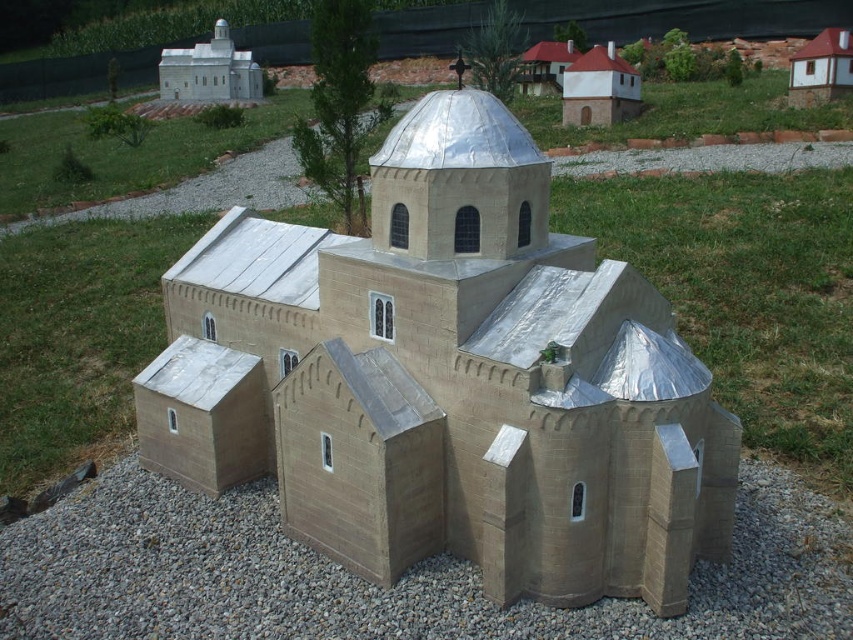
Can you confirm if white matte chapel at upper left is positioned above white wood house at upper right?

Yes.

Locate an element on the screen. white matte chapel at upper left is located at coordinates (209, 72).

Between point (213, 76) and point (827, 42), which one is positioned behind?

The point (213, 76) is more distant.

Find the location of `white matte chapel at upper left`. white matte chapel at upper left is located at coordinates (209, 72).

Which of these two, matte silver church at center or white matte chapel at upper left, stands shorter?

Standing shorter between the two is white matte chapel at upper left.

In the scene shown: Which is above, matte silver church at center or white matte chapel at upper left?

white matte chapel at upper left is above.

Is point (263, 237) positioned after point (202, 76)?

No.

Image resolution: width=853 pixels, height=640 pixels. I want to click on matte silver church at center, so click(x=453, y=380).

Between matte silver church at center and white wood house at upper right, which one has less height?

white wood house at upper right

Between point (357, 490) and point (808, 97), which one is positioned behind?

The point (808, 97) is more distant.

Is point (422, 230) positioned after point (807, 65)?

No, (422, 230) is in front of (807, 65).

Find the location of a particular element. The image size is (853, 640). matte silver church at center is located at coordinates (453, 380).